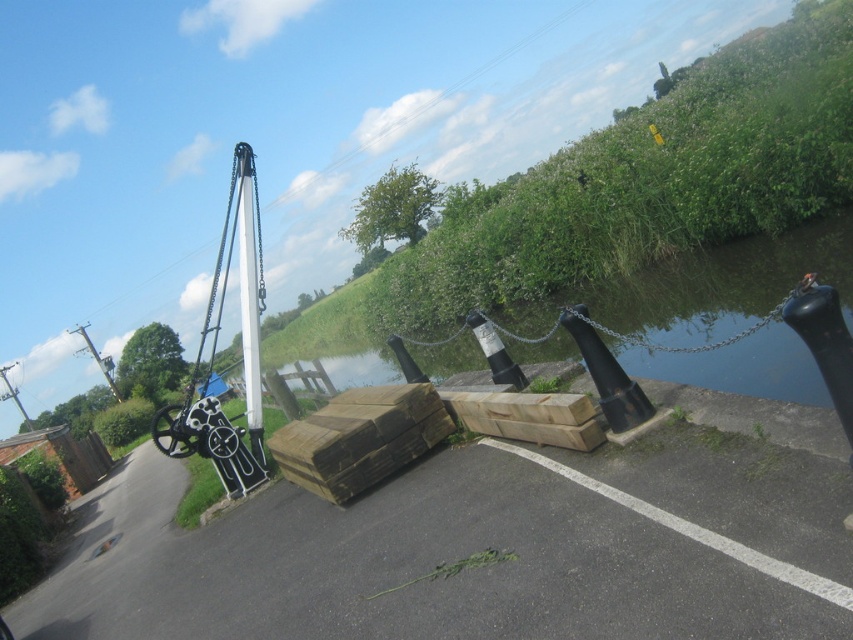
You are standing at the point marked by the coordinates point (708, 288). What is the nearest object to you in the scene?

The nearest object to you at point (708, 288) is the smooth concrete waterway at center, as the coordinates provided directly correspond to its location in the scene.

You are a delivery person with a cart that is 1.5 meters wide. You need to transport a package from the smooth concrete waterway at center to the white glossy pole at center. Is there enough space between them for your cart to pass through?

The distance between the smooth concrete waterway at center and the white glossy pole at center is 7.40 meters. Since your cart is only 1.5 meters wide, there is ample space for it to pass through the 7.40 meters gap between them.

Looking at this image, you are a boat operator who needs to navigate through the canal. You see the smooth concrete waterway at center and the white glossy pole at center. Which one is positioned higher in the scene?

The smooth concrete waterway at center is located above the white glossy pole at center, so it is positioned higher in the scene.